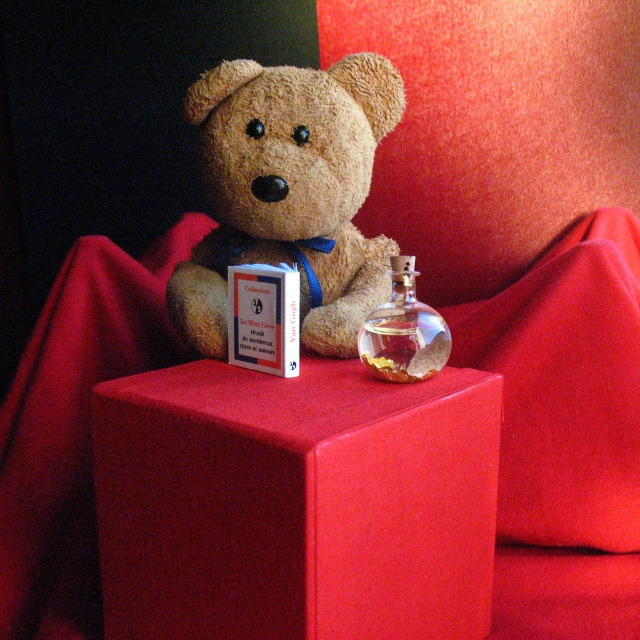
You are a delivery robot that needs to place a small package between the matte red cube at center and the transparent glass bottle at center. The package is 8 inches long. Will it fit in the space between them?

The space between the matte red cube at center and the transparent glass bottle at center is 7.78 inches. Since the package is 8 inches long, it will not fit in the space between them.

You are a photographer trying to capture the teddy bear sitting on the red fabric surface. You notice a velvet red cushion at upper center at point [564,429]. Where should you position the cushion relative to the teddy bear to ensure it is centered in the frame?

The velvet red cushion at upper center is already positioned at point [564,429], which is the center of the frame. Therefore, it is already correctly placed to ensure the teddy bear is centered in the frame.

Looking at this image, you are a photographer standing in front of the teddy bear scene. You want to take a closeup shot of the teddy bear without the velvet red cushion at upper center appearing in the frame. The camera you are using has a minimum focusing distance of 1 meter. Can you achieve this?

The velvet red cushion at upper center is 1.01 meters from camera. Since the minimum focusing distance is 1 meter, you can move slightly closer to get within 1 meter to avoid including the velvet red cushion at upper center in the frame.